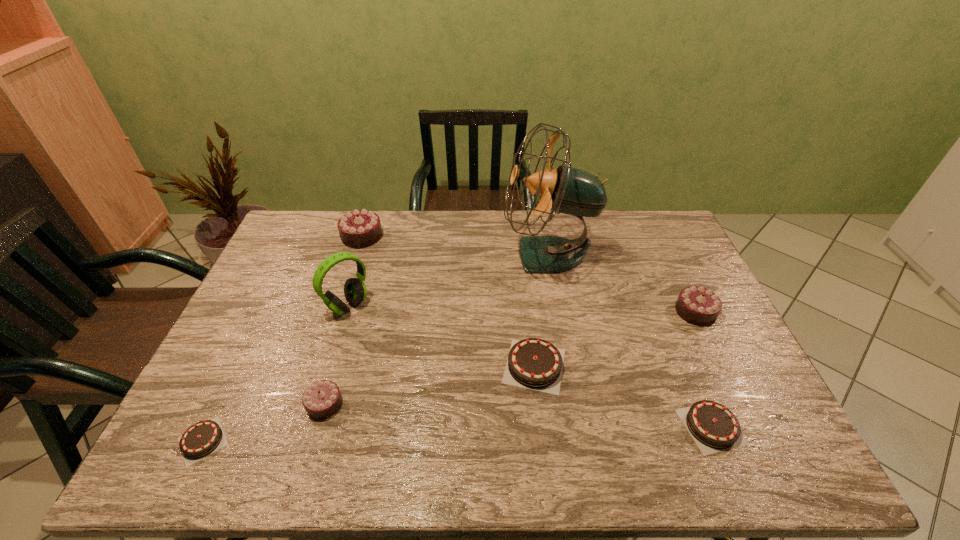
Locate an element on the screen. This screenshot has width=960, height=540. vacant space located on the back of the second nearest chocolate chocolate cake is located at coordinates (658, 233).

This screenshot has width=960, height=540. Identify the location of free spot located on the right of the smallest chocolate chocolate cake. (366, 404).

Locate an element on the screen. free spot located 0.300m on the right of the second brown chocolate cake from left to right is located at coordinates (679, 366).

Find the location of a particular element. The image size is (960, 540). free region located on the left of the second biggest brown chocolate cake is located at coordinates (636, 427).

Locate an element on the screen. The height and width of the screenshot is (540, 960). free spot located on the right of the shortest chocolate cake is located at coordinates (361, 441).

The image size is (960, 540). I want to click on fan positioned at the far edge, so click(x=567, y=190).

Identify the location of chocolate cake at the far edge. (362, 228).

Find the location of a particular element. This screenshot has width=960, height=540. object at the left edge is located at coordinates [203, 438].

Where is `object present at the near left corner`? This screenshot has width=960, height=540. object present at the near left corner is located at coordinates (203, 438).

At what (x,y) coordinates should I click in order to perform the action: click on object present at the near right corner. Please return your answer as a coordinate pair (x, y). This screenshot has width=960, height=540. Looking at the image, I should click on (714, 428).